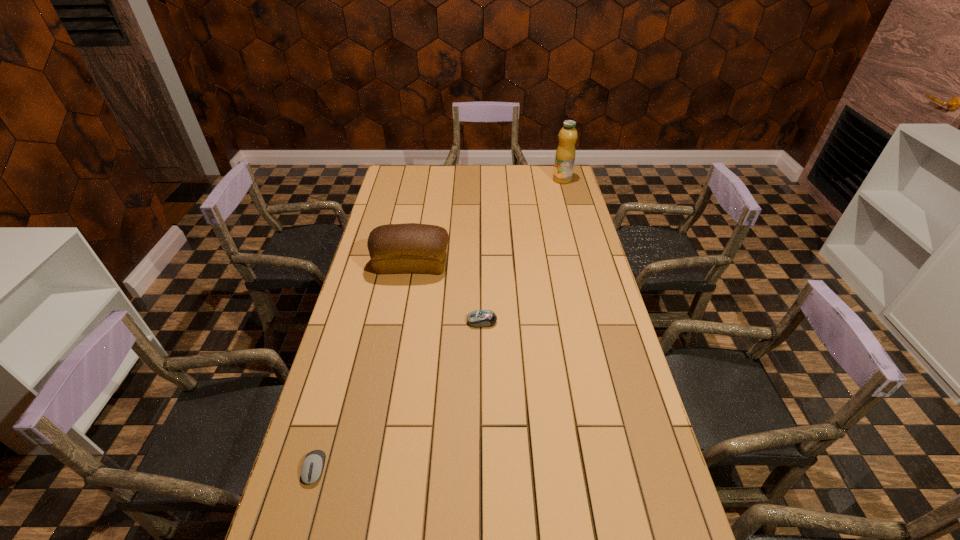
Locate an element on the screen. free region located on the wheel side of the third object from left to right is located at coordinates (348, 321).

Image resolution: width=960 pixels, height=540 pixels. I want to click on free space located 0.250m on the wheel side of the third object from left to right, so click(392, 321).

Where is `vacant area located 0.130m on the wheel side of the third object from left to right`? The image size is (960, 540). vacant area located 0.130m on the wheel side of the third object from left to right is located at coordinates (428, 321).

Where is `free space located 0.110m on the wheel side of the nearest object`? The image size is (960, 540). free space located 0.110m on the wheel side of the nearest object is located at coordinates (297, 536).

Find the location of a particular element. object at the far edge is located at coordinates (565, 154).

I want to click on bread that is positioned at the left edge, so click(411, 247).

Where is `computer equipment present at the left edge`? The height and width of the screenshot is (540, 960). computer equipment present at the left edge is located at coordinates (312, 467).

Identify the location of object present at the right edge. The width and height of the screenshot is (960, 540). (565, 154).

Identify the location of object positioned at the far right corner. (565, 154).

In the image, there is a desktop. At what (x,y) coordinates should I click in order to perform the action: click on vacant space at the far edge. Please return your answer as a coordinate pair (x, y). Image resolution: width=960 pixels, height=540 pixels. Looking at the image, I should click on (x=511, y=168).